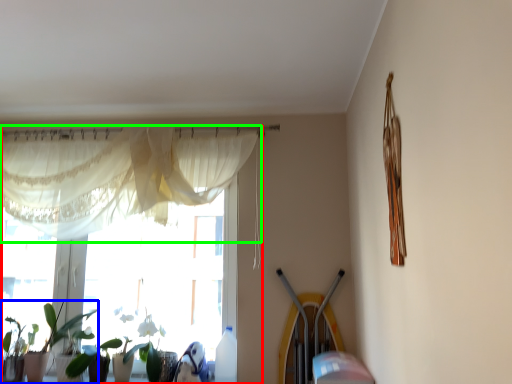
Question: Estimate the real-world distances between objects in this image. Which object is closer to window (highlighted by a red box), houseplant (highlighted by a blue box) or curtain (highlighted by a green box)?

Choices:
 (A) houseplant
 (B) curtain

Answer: (B)